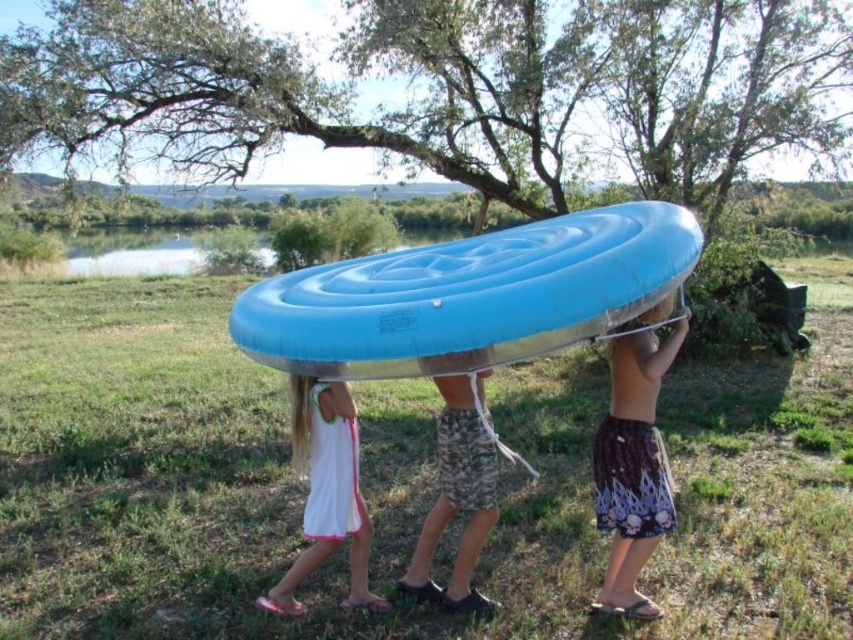
Consider the image. Which of these two, blue rubber raft at center or printed cotton shorts at center, stands shorter?

blue rubber raft at center is shorter.

Is blue rubber raft at center wider than printed cotton shorts at center?

Correct, the width of blue rubber raft at center exceeds that of printed cotton shorts at center.

The image size is (853, 640). What do you see at coordinates (469, 296) in the screenshot?
I see `blue rubber raft at center` at bounding box center [469, 296].

This screenshot has width=853, height=640. In order to click on blue rubber raft at center in this screenshot , I will do `click(469, 296)`.

Can you confirm if printed cotton shorts at center is shorter than blue rubber boat at center?

In fact, printed cotton shorts at center may be taller than blue rubber boat at center.

What do you see at coordinates (631, 467) in the screenshot? I see `printed cotton shorts at center` at bounding box center [631, 467].

This screenshot has height=640, width=853. Identify the location of printed cotton shorts at center. (631, 467).

I want to click on printed cotton shorts at center, so click(x=631, y=467).

Does printed cotton shorts at center have a lesser height compared to white cotton dress at center?

In fact, printed cotton shorts at center may be taller than white cotton dress at center.

Is point (653, 490) more distant than point (305, 396)?

No, it is in front of (305, 396).

Where is `printed cotton shorts at center`? printed cotton shorts at center is located at coordinates (631, 467).

The image size is (853, 640). In order to click on printed cotton shorts at center in this screenshot , I will do `click(631, 467)`.